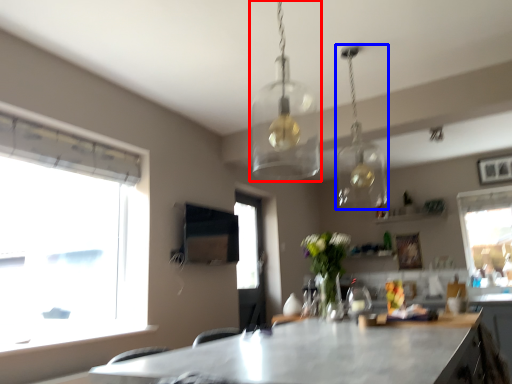
Question: Which point is further to the camera, lamp (highlighted by a red box) or lamp (highlighted by a blue box)?

Choices:
 (A) lamp
 (B) lamp

Answer: (B)